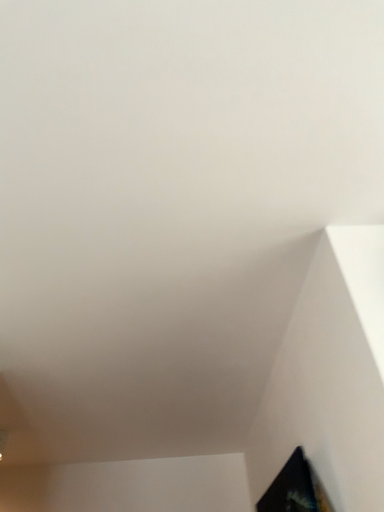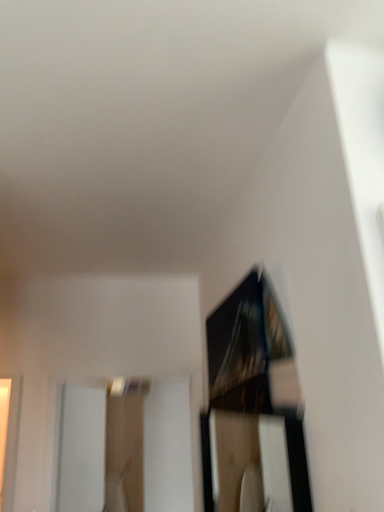
Question: Which way did the camera rotate in the video?

Choices:
 (A) rotated downward
 (B) rotated upward

Answer: (A)